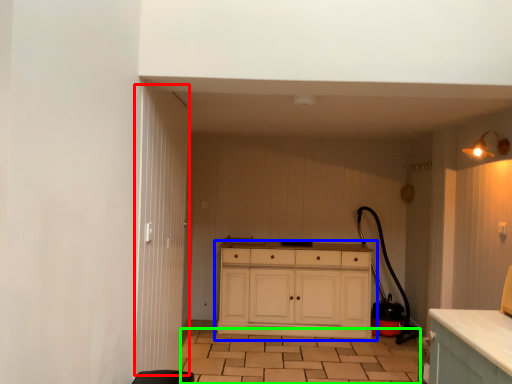
Question: Based on their relative distances, which object is nearer to door (highlighted by a red box)? Choose from chest of drawers (highlighted by a blue box) and tile (highlighted by a green box).

Choices:
 (A) chest of drawers
 (B) tile

Answer: (B)